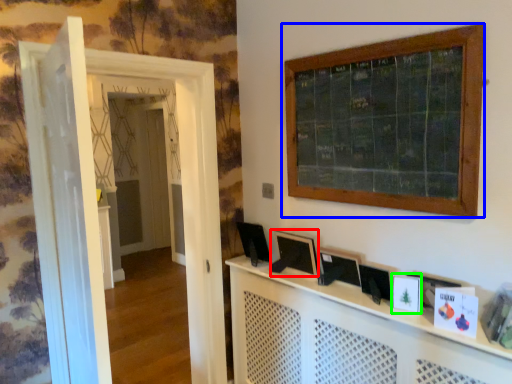
Question: Estimate the real-world distances between objects in this image. Which object is farther from picture frame (highlighted by a red box), window (highlighted by a blue box) or picture frame (highlighted by a green box)?

Choices:
 (A) window
 (B) picture frame

Answer: (A)